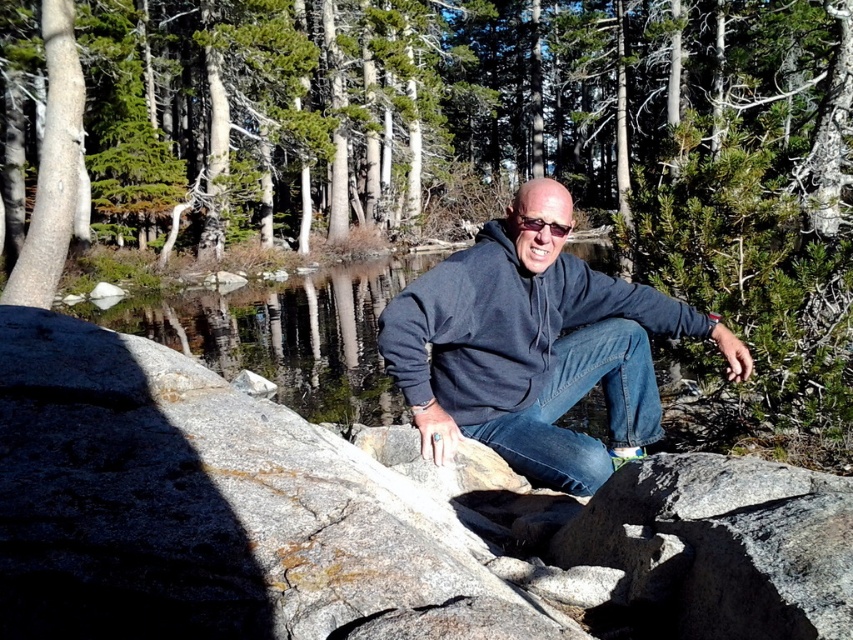
Question: Which object appears farthest from the camera in this image?

Choices:
 (A) denim at center
 (B) dark blue hoodie at center
 (C) green textured pine tree at upper center

Answer: (C)

Question: Which object appears closest to the camera in this image?

Choices:
 (A) dark blue hoodie at center
 (B) green textured pine tree at upper center
 (C) denim at center

Answer: (A)

Question: In this image, where is dark blue hoodie at center located relative to denim at center?

Choices:
 (A) right
 (B) left

Answer: (B)

Question: In this image, where is green textured pine tree at upper center located relative to denim at center?

Choices:
 (A) right
 (B) left

Answer: (B)

Question: Among these points, which one is nearest to the camera?

Choices:
 (A) (616, 451)
 (B) (596, 330)

Answer: (A)

Question: Considering the relative positions of green textured pine tree at upper center and denim at center in the image provided, where is green textured pine tree at upper center located with respect to denim at center?

Choices:
 (A) left
 (B) right

Answer: (A)